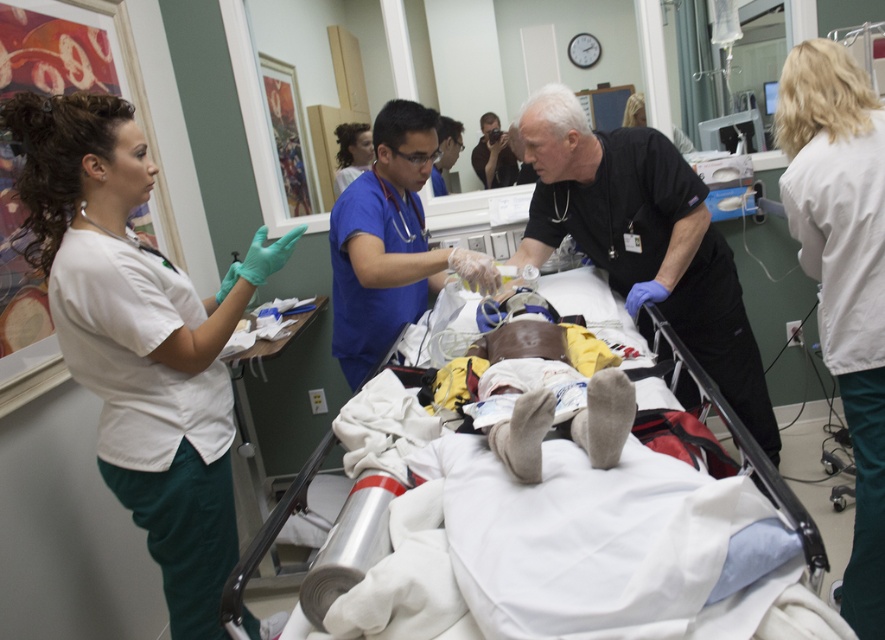
Question: Does blue scrubs at center appear on the left side of matte blue scrubs at center?

Choices:
 (A) yes
 (B) no

Answer: (B)

Question: Is brown leather boots at center behind white fabric hospital bed at center?

Choices:
 (A) no
 (B) yes

Answer: (B)

Question: Based on their relative distances, which object is nearer to the white smooth scrubs at left?

Choices:
 (A) brown leather boots at center
 (B) black matte uniform at center

Answer: (A)

Question: Based on their relative distances, which object is nearer to the black matte uniform at center?

Choices:
 (A) matte blue scrubs at center
 (B) brown leather boots at center
 (C) blue scrubs at center

Answer: (C)

Question: Based on their relative distances, which object is nearer to the black matte uniform at center?

Choices:
 (A) white fabric hospital bed at center
 (B) white smooth coat at upper right

Answer: (B)

Question: Can you confirm if black matte uniform at center is smaller than matte blue scrubs at center?

Choices:
 (A) no
 (B) yes

Answer: (A)